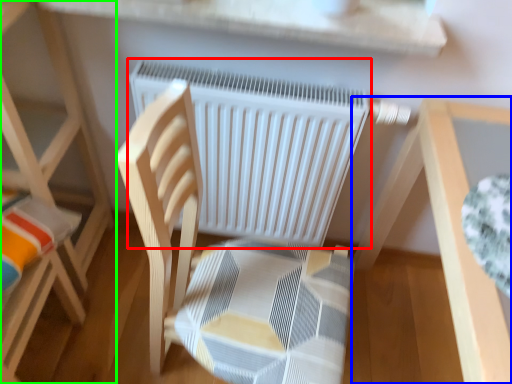
Question: Which object is the farthest from radiator (highlighted by a red box)? Choose among these: table (highlighted by a blue box) or furniture (highlighted by a green box).

Choices:
 (A) table
 (B) furniture

Answer: (B)